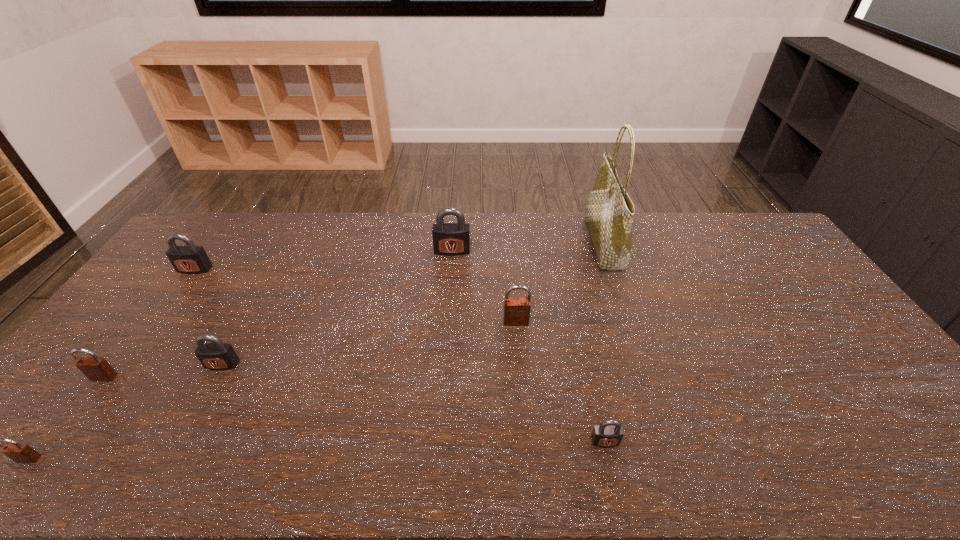
Identify the location of vacant space situated 0.170m on the front-facing side of the second nearest brown padlock. The image size is (960, 540). (55, 443).

You are a GUI agent. You are given a task and a screenshot of the screen. Output one action in this format:
    pyautogui.click(x=<x>, y=<y>)
    Task: Click on the vacant region located on the front of the fourth nearest padlock near the keyhole
    
    Given the screenshot: What is the action you would take?
    pyautogui.click(x=168, y=467)

Where is `vacant space located 0.060m on the front of the seventh farthest object near the keyhole`? vacant space located 0.060m on the front of the seventh farthest object near the keyhole is located at coordinates (612, 474).

The height and width of the screenshot is (540, 960). In order to click on shopping bag that is at the far edge in this screenshot , I will do `click(609, 212)`.

Find the location of a particular element. padlock that is at the far edge is located at coordinates (449, 239).

Locate an element on the screen. object located at the near left corner is located at coordinates point(20,453).

Identify the location of vacant space at the far edge. (681, 244).

Identify the location of free space at the near edge of the desktop. The height and width of the screenshot is (540, 960). (775, 451).

Find the location of a particular element. The height and width of the screenshot is (540, 960). vacant space at the left edge is located at coordinates (138, 362).

Locate an element on the screen. free spot between the rightmost gray padlock and the farthest padlock is located at coordinates (529, 346).